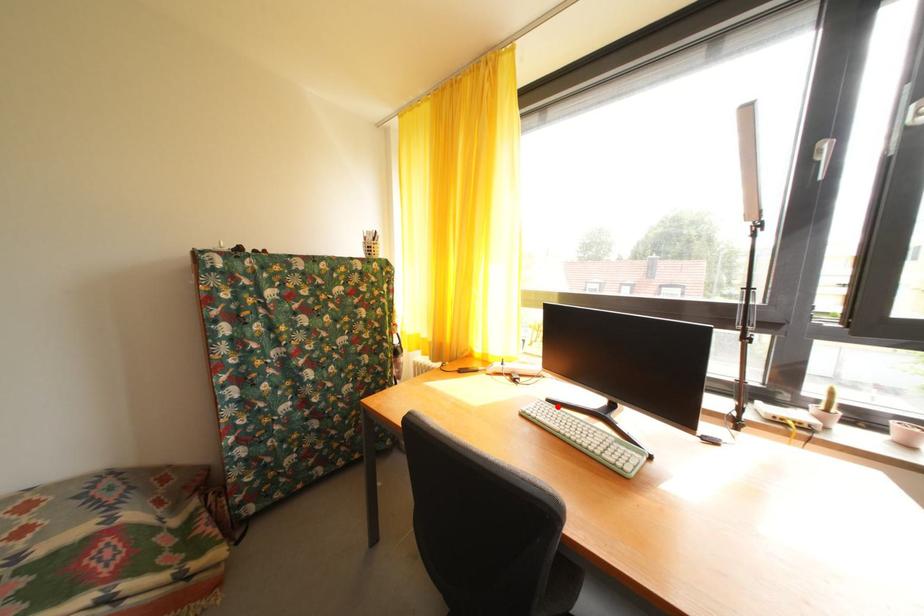
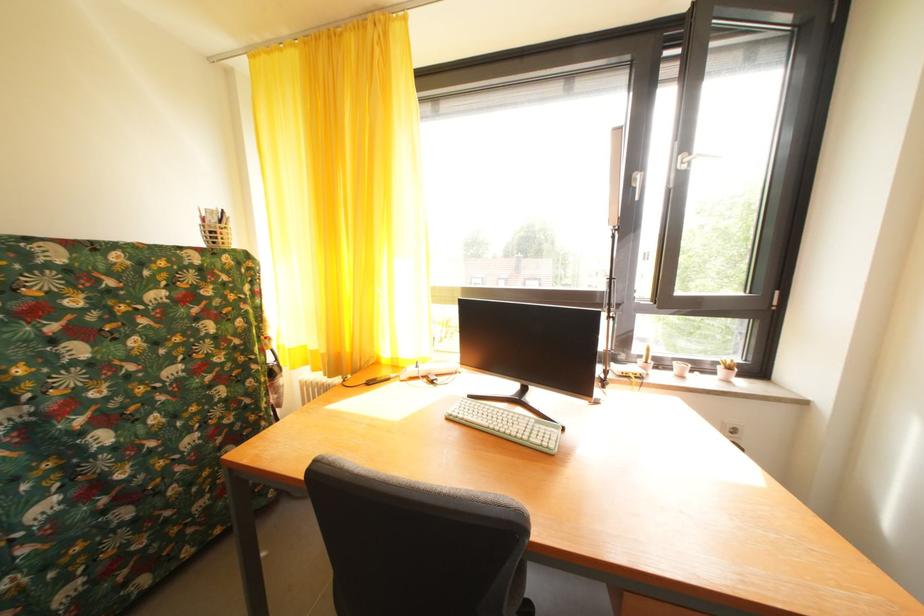
The point at the highlighted location is marked in the first image. Where is the corresponding point in the second image?

(479, 402)